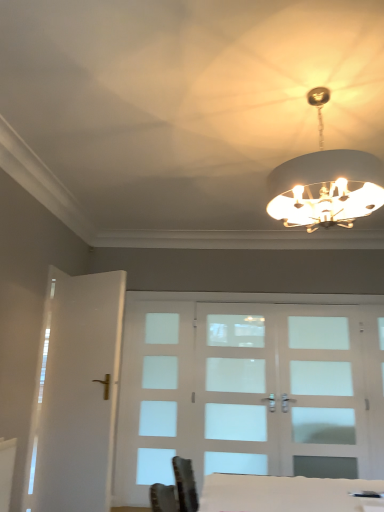
Question: Is clear glass door at center, which is the second screen door from left to right, smaller than white glossy table at lower center?

Choices:
 (A) yes
 (B) no

Answer: (B)

Question: Is clear glass door at center, which is the second screen door from right to left, turned away from white glossy table at lower center?

Choices:
 (A) yes
 (B) no

Answer: (B)

Question: Is white glossy table at lower center a part of clear glass door at center, which is the second screen door from right to left?

Choices:
 (A) no
 (B) yes

Answer: (A)

Question: Could you tell me if clear glass door at center, which is the second screen door from left to right, is turned towards white glossy table at lower center?

Choices:
 (A) no
 (B) yes

Answer: (B)

Question: Considering the relative sizes of clear glass door at center, which is the second screen door from right to left, and white glossy table at lower center in the image provided, is clear glass door at center, which is the second screen door from right to left, bigger than white glossy table at lower center?

Choices:
 (A) yes
 (B) no

Answer: (A)

Question: Is white glossy door at left, arranged as the first screen door when viewed from the left, spatially inside white frosted glass door at center, which is the first screen door from right to left, or outside of it?

Choices:
 (A) outside
 (B) inside

Answer: (A)

Question: Is point (94, 374) positioned closer to the camera than point (307, 356)?

Choices:
 (A) farther
 (B) closer

Answer: (B)

Question: Is white glossy door at left, the 3th screen door viewed from the right, wider or thinner than white frosted glass door at center, which is the first screen door from right to left?

Choices:
 (A) thin
 (B) wide

Answer: (B)

Question: Visually, is white glossy door at left, the 3th screen door viewed from the right, positioned to the left or to the right of white frosted glass door at center, which is the first screen door from right to left?

Choices:
 (A) right
 (B) left

Answer: (B)

Question: From the image's perspective, is white glass chandelier at upper center above or below clear glass door at center, which is the second screen door from left to right?

Choices:
 (A) above
 (B) below

Answer: (A)

Question: From a real-world perspective, relative to clear glass door at center, which is the second screen door from left to right, is white glass chandelier at upper center vertically above or below?

Choices:
 (A) above
 (B) below

Answer: (A)

Question: Is white glass chandelier at upper center inside or outside of clear glass door at center, which is the second screen door from right to left?

Choices:
 (A) outside
 (B) inside

Answer: (A)

Question: In terms of size, does white glass chandelier at upper center appear bigger or smaller than clear glass door at center, which is the second screen door from left to right?

Choices:
 (A) big
 (B) small

Answer: (A)

Question: In terms of size, does white glossy table at lower center appear bigger or smaller than white glossy door at left, arranged as the first screen door when viewed from the left?

Choices:
 (A) big
 (B) small

Answer: (B)

Question: Is white glossy table at lower center spatially inside white glossy door at left, arranged as the first screen door when viewed from the left, or outside of it?

Choices:
 (A) inside
 (B) outside

Answer: (B)